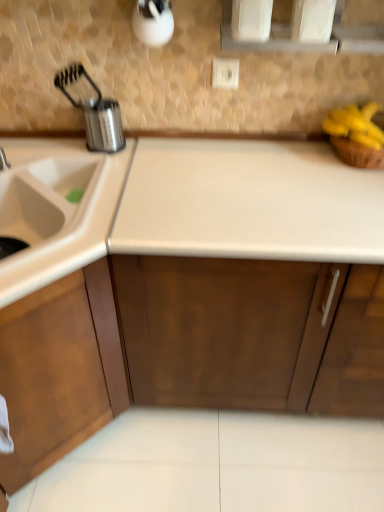
Where is `vacant area situated to the left side of metallic silver canister at upper left`? The height and width of the screenshot is (512, 384). vacant area situated to the left side of metallic silver canister at upper left is located at coordinates (46, 148).